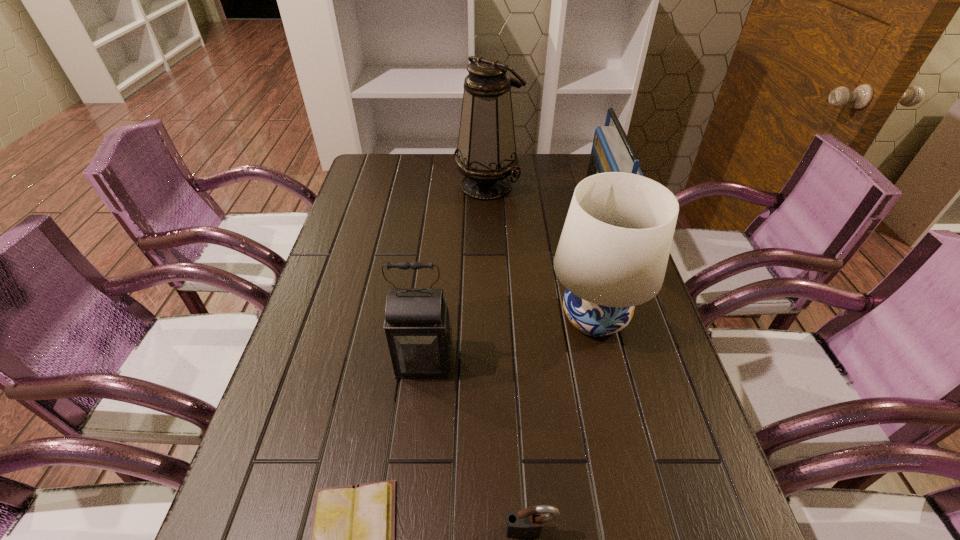
The image size is (960, 540). In order to click on vacant space that is in between the lampshade and the oil lamp in this screenshot , I will do `click(540, 252)`.

Locate which object ranks third in proximity to the lantern. Please provide its 2D coordinates. Your answer should be formatted as a tuple, i.e. [(x, y)], where the tuple contains the x and y coordinates of a point satisfying the conditions above.

[(527, 523)]

The height and width of the screenshot is (540, 960). Identify the location of object that stands as the second closest to the shortest object. (418, 328).

Locate an element on the screen. The height and width of the screenshot is (540, 960). blank space that satisfies the following two spatial constraints: 1. on the front-facing side of the lampshade; 2. on the front-facing side of the lantern is located at coordinates (605, 362).

What are the coordinates of `vacant area in the image that satisfies the following two spatial constraints: 1. on the front-facing side of the lampshade; 2. with the keyhole on the front of the padlock` in the screenshot? It's located at (646, 531).

The height and width of the screenshot is (540, 960). I want to click on vacant region that satisfies the following two spatial constraints: 1. on the front panel of the radio receiver; 2. on the front-facing side of the lantern, so click(652, 362).

Locate an element on the screen. The image size is (960, 540). blank space that satisfies the following two spatial constraints: 1. on the front panel of the radio receiver; 2. with the keyhole on the front of the padlock is located at coordinates (708, 531).

Identify the location of vacant space that satisfies the following two spatial constraints: 1. on the front-facing side of the lampshade; 2. with the keyhole on the front of the second shortest object. This screenshot has width=960, height=540. (646, 531).